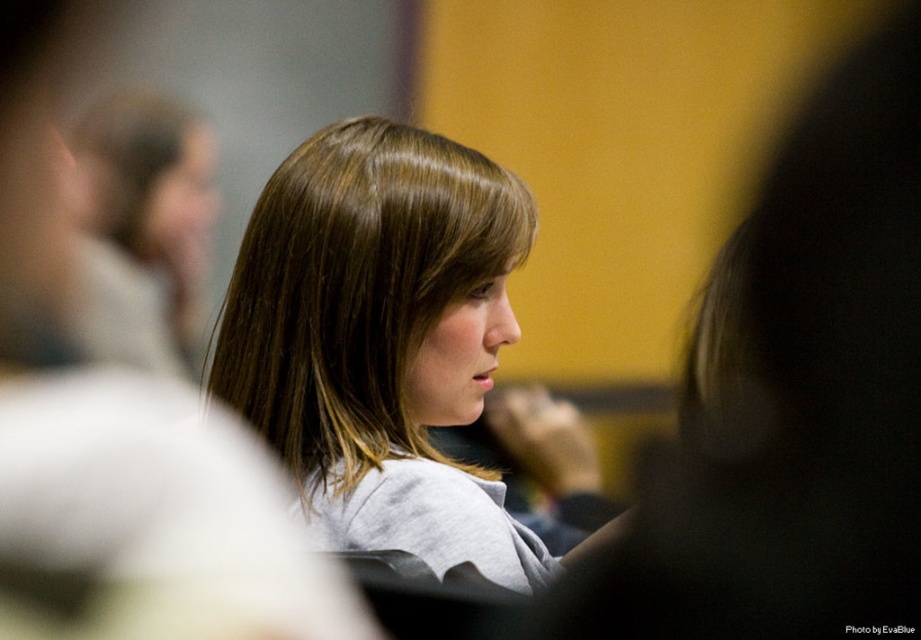
You are a photographer who wants to adjust the focus to capture both the smooth brown hair at center and the brown smooth hair at upper left clearly. Based on their positions, which hair is closer to the camera?

The smooth brown hair at center is to the right of brown smooth hair at upper left, so the brown smooth hair at upper left is closer to the camera.

You are a photographer who wants to adjust the focus to highlight the person in the scene. The point marked as point (383,340) is located on the subject. Where exactly on the person is this point located?

The point (383,340) marks the smooth brown hair at center.